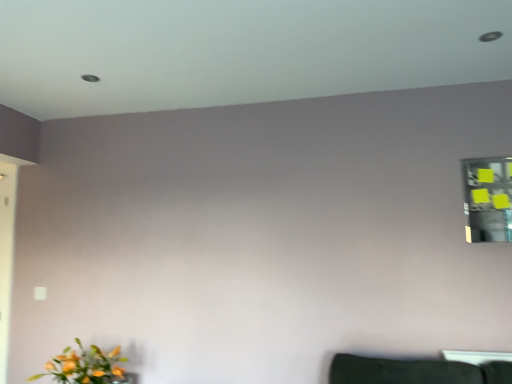
Question: From a real-world perspective, is yellow sticky notes at upper right physically below matte orange flowers at lower left?

Choices:
 (A) yes
 (B) no

Answer: (B)

Question: From the image's perspective, does yellow sticky notes at upper right appear lower than matte orange flowers at lower left?

Choices:
 (A) no
 (B) yes

Answer: (A)

Question: Considering the relative sizes of yellow sticky notes at upper right and matte orange flowers at lower left in the image provided, is yellow sticky notes at upper right bigger than matte orange flowers at lower left?

Choices:
 (A) yes
 (B) no

Answer: (B)

Question: Is yellow sticky notes at upper right taller than matte orange flowers at lower left?

Choices:
 (A) no
 (B) yes

Answer: (B)

Question: From the image's perspective, does yellow sticky notes at upper right appear higher than matte orange flowers at lower left?

Choices:
 (A) no
 (B) yes

Answer: (B)

Question: Is yellow sticky notes at upper right wider than matte orange flowers at lower left?

Choices:
 (A) no
 (B) yes

Answer: (A)

Question: Considering the relative sizes of matte orange flowers at lower left and yellow sticky notes at upper right in the image provided, is matte orange flowers at lower left shorter than yellow sticky notes at upper right?

Choices:
 (A) no
 (B) yes

Answer: (B)

Question: Considering the relative sizes of matte orange flowers at lower left and yellow sticky notes at upper right in the image provided, is matte orange flowers at lower left taller than yellow sticky notes at upper right?

Choices:
 (A) yes
 (B) no

Answer: (B)

Question: Is matte orange flowers at lower left oriented away from yellow sticky notes at upper right?

Choices:
 (A) no
 (B) yes

Answer: (A)

Question: From the image's perspective, is matte orange flowers at lower left beneath yellow sticky notes at upper right?

Choices:
 (A) no
 (B) yes

Answer: (B)

Question: Considering the relative positions of matte orange flowers at lower left and yellow sticky notes at upper right in the image provided, is matte orange flowers at lower left to the left of yellow sticky notes at upper right from the viewer's perspective?

Choices:
 (A) yes
 (B) no

Answer: (A)

Question: Considering the relative sizes of matte orange flowers at lower left and yellow sticky notes at upper right in the image provided, is matte orange flowers at lower left bigger than yellow sticky notes at upper right?

Choices:
 (A) yes
 (B) no

Answer: (A)

Question: Is yellow sticky notes at upper right situated inside matte orange flowers at lower left or outside?

Choices:
 (A) inside
 (B) outside

Answer: (B)